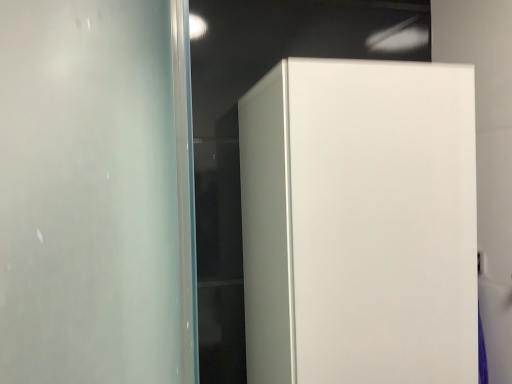
Describe the element at coordinates (359, 223) in the screenshot. I see `white glossy cupboard at center` at that location.

What is the approximate width of white glossy cupboard at center?

white glossy cupboard at center is 14.11 inches wide.

Locate an element on the screen. Image resolution: width=512 pixels, height=384 pixels. white glossy cupboard at center is located at coordinates (359, 223).

Where is `white glossy cupboard at center`? Image resolution: width=512 pixels, height=384 pixels. white glossy cupboard at center is located at coordinates (359, 223).